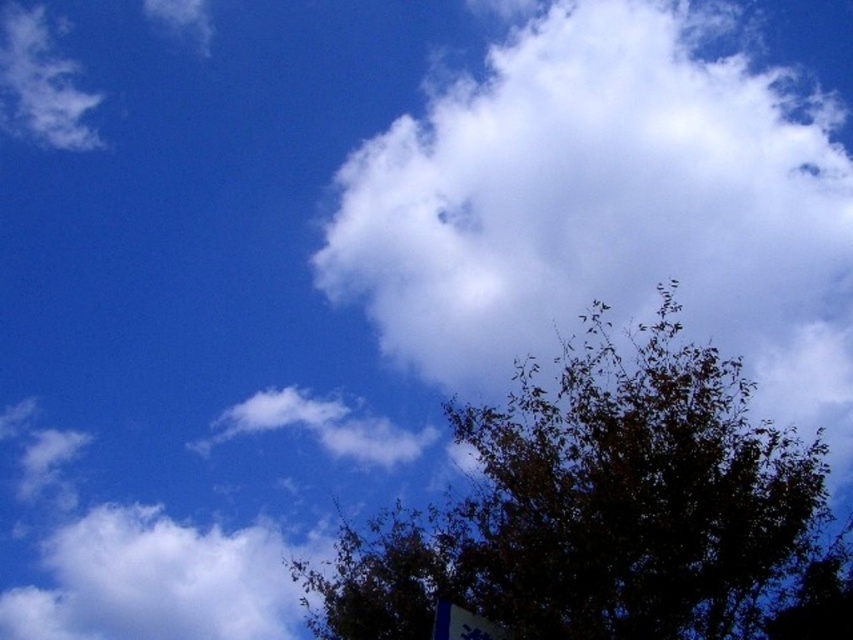
You are an astronomer observing two points in the sky, point 1 at coordinates point (576, 76) and point 2 at coordinates point (611, 536). Which point is closer to the Earth?

Point (611, 536) is closer to the Earth because it is in front of point (576, 76).

You are an astronomer observing the sky and notice two clouds, the white fluffy cloud at upper center and the white fluffy cloud at upper left. Which cloud would appear larger to you from your current position?

The white fluffy cloud at upper center appears larger because it is closer to the viewer than the white fluffy cloud at upper left.

You are an observer standing on the ground looking at the dark green leafy tree at bottom right and the white fluffy cloud at upper left. Which object appears taller from your perspective?

The dark green leafy tree at bottom right appears taller than the white fluffy cloud at upper left from your perspective because the dark green leafy tree at bottom right has a greater height compared to white fluffy cloud at upper left.